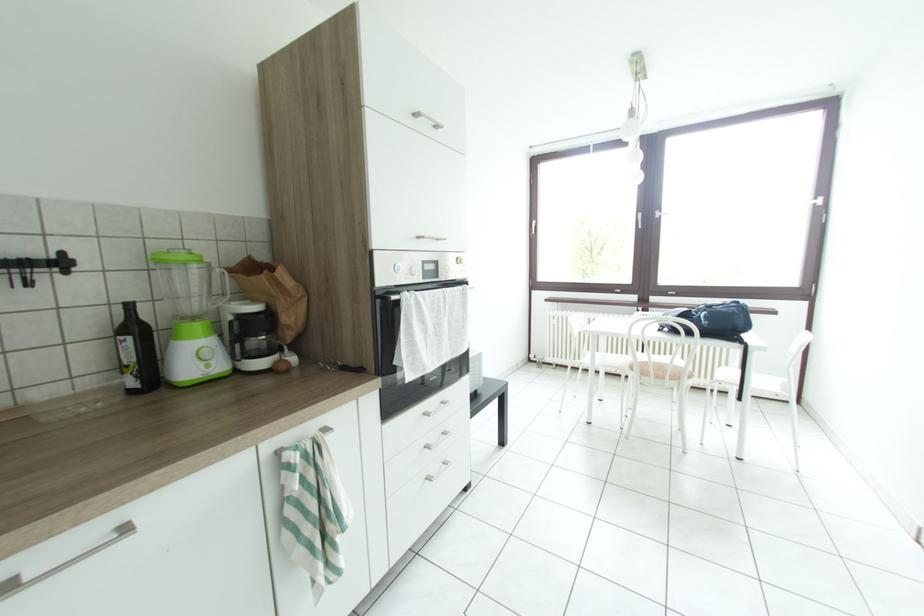
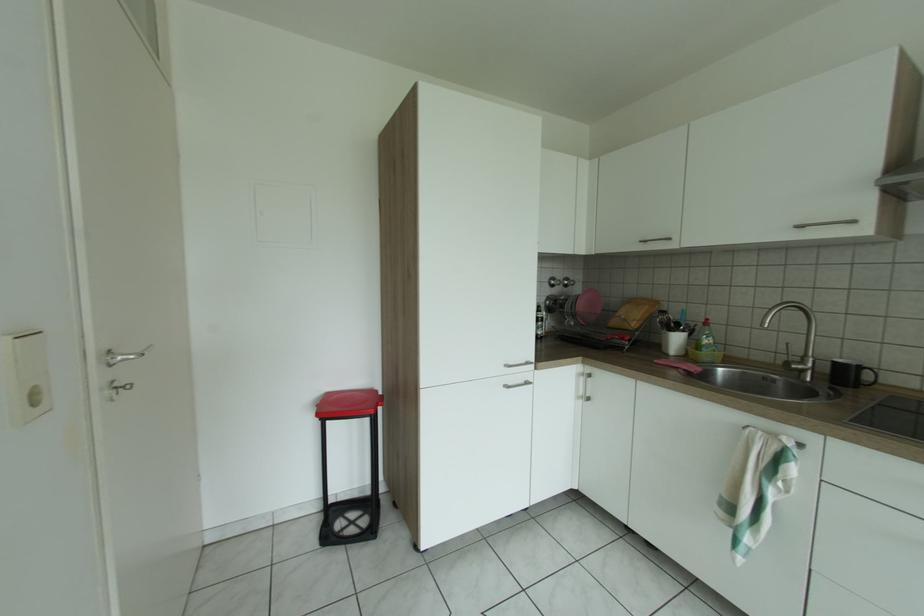
Question: The camera is either moving clockwise (left) or counter-clockwise (right) around the object. The first image is from the beginning of the video and the second image is from the end. Is the camera moving left or right when shooting the video?

Choices:
 (A) Left
 (B) Right

Answer: (B)